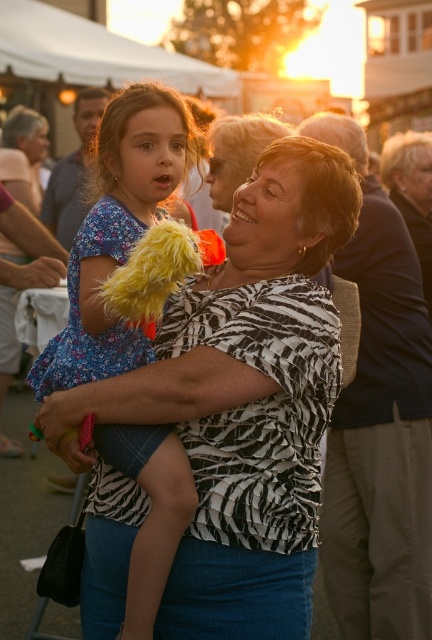
The image size is (432, 640). What do you see at coordinates (244, 400) in the screenshot?
I see `zebra-patterned blouse at center` at bounding box center [244, 400].

The image size is (432, 640). Identify the location of zebra-patterned blouse at center. (244, 400).